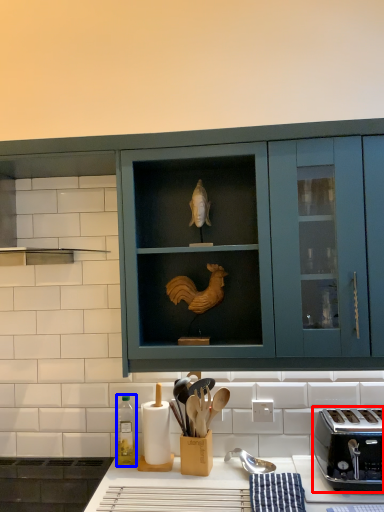
Question: Which point is further to the camera, toaster (highlighted by a red box) or bottle (highlighted by a blue box)?

Choices:
 (A) toaster
 (B) bottle

Answer: (B)